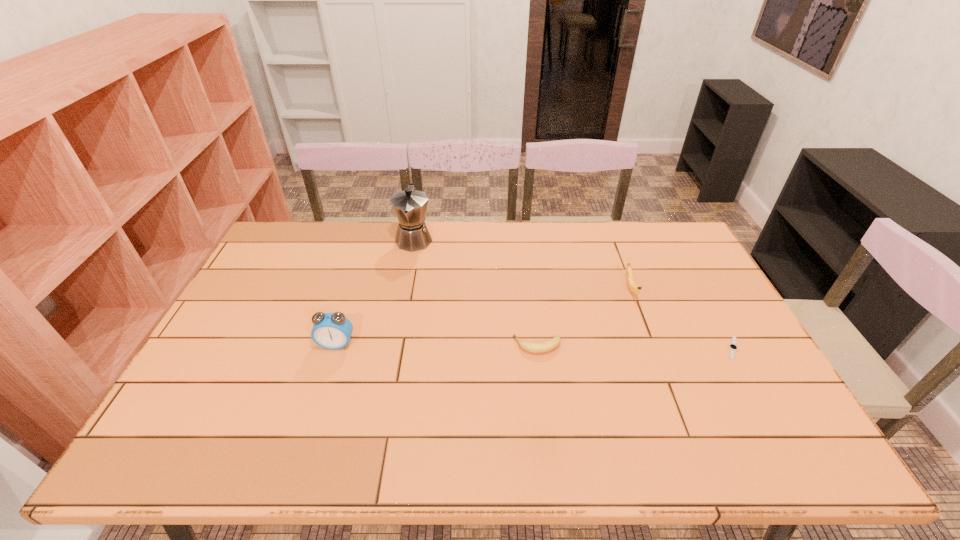
Find the location of a particular element. The width and height of the screenshot is (960, 540). the second object from left to right is located at coordinates (410, 206).

In order to click on coffeepot in this screenshot , I will do 410,206.

Find the location of a particular element. alarm clock is located at coordinates (333, 331).

Where is `the leftmost object`? The image size is (960, 540). the leftmost object is located at coordinates (333, 331).

Locate an element on the screen. the farther banana is located at coordinates (632, 286).

Find the location of a particular element. The image size is (960, 540). the right banana is located at coordinates (x=632, y=286).

The width and height of the screenshot is (960, 540). What are the coordinates of `the shorter banana` in the screenshot? It's located at (547, 346).

Find the location of `the left banana`. the left banana is located at coordinates (547, 346).

I want to click on the rightmost object, so click(x=732, y=346).

You are a GUI agent. You are given a task and a screenshot of the screen. Output one action in this format:
    pyautogui.click(x=<x>, y=<y>)
    Task: Click on the watch
    
    Given the screenshot: What is the action you would take?
    pyautogui.click(x=732, y=346)